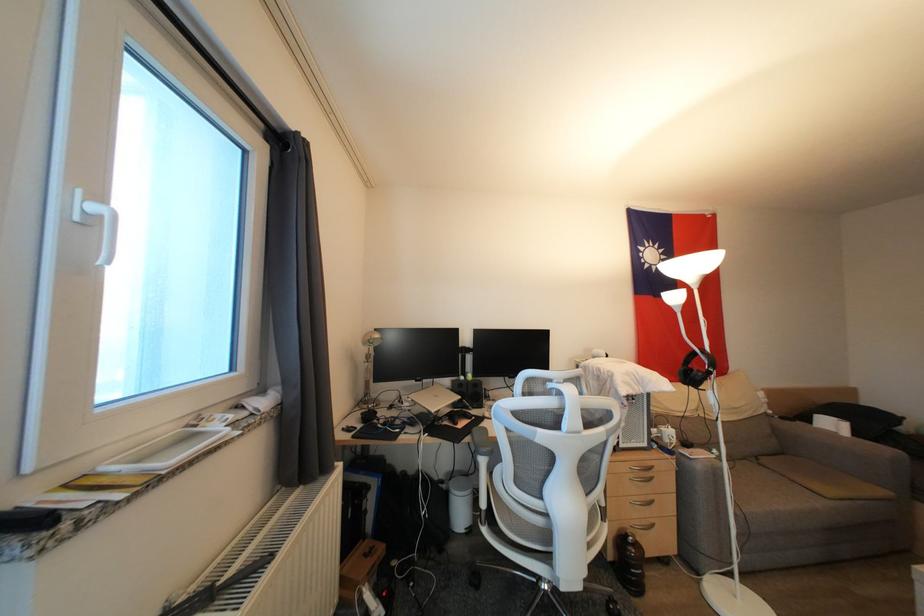
Where would you lift the dark plastic bottle? Please return your answer as a coordinate pair (x, y).

(629, 562)